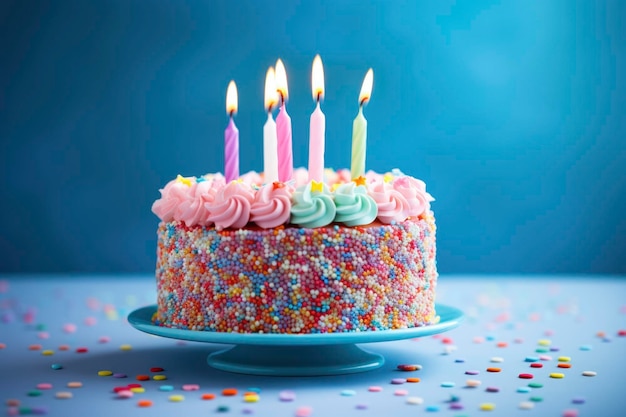
You are a GUI agent. You are given a task and a screenshot of the screen. Output one action in this format:
    pyautogui.click(x=<x>, y=<y>)
    Task: Click on the candle flame
    The height and width of the screenshot is (417, 626).
    Given the screenshot: What is the action you would take?
    pyautogui.click(x=231, y=99), pyautogui.click(x=272, y=92), pyautogui.click(x=280, y=77), pyautogui.click(x=317, y=79), pyautogui.click(x=365, y=87)